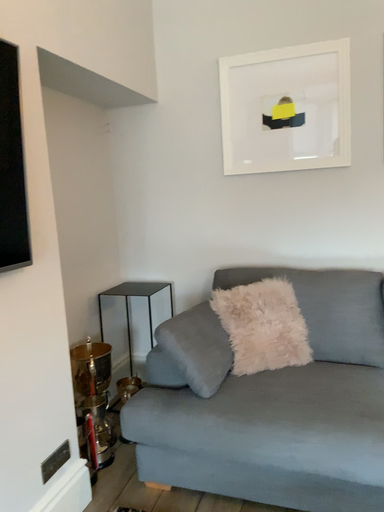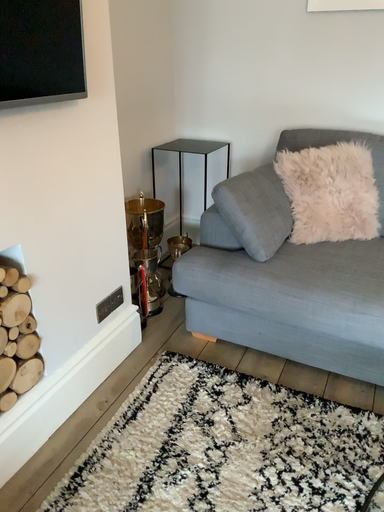
Question: How did the camera likely rotate when shooting the video?

Choices:
 (A) rotated upward
 (B) rotated downward

Answer: (B)